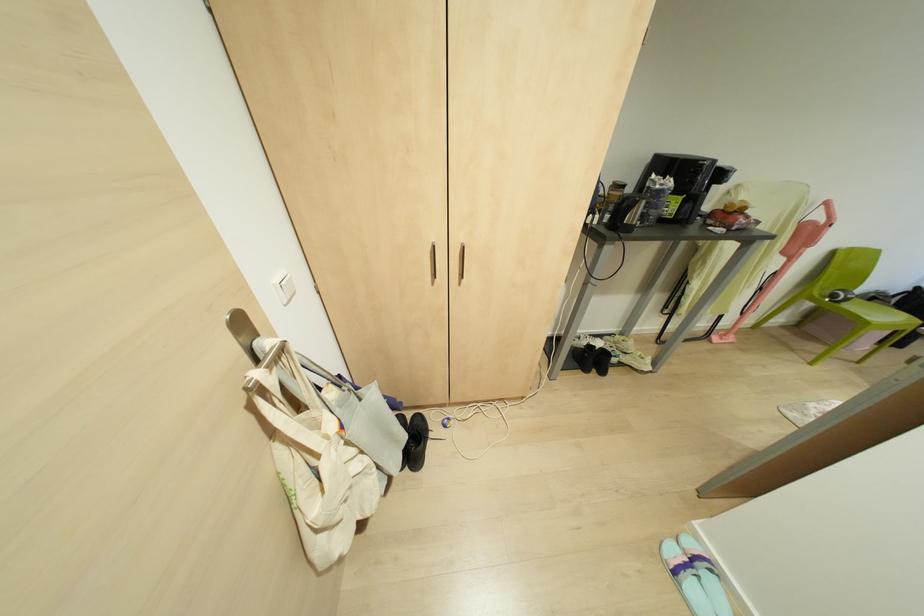
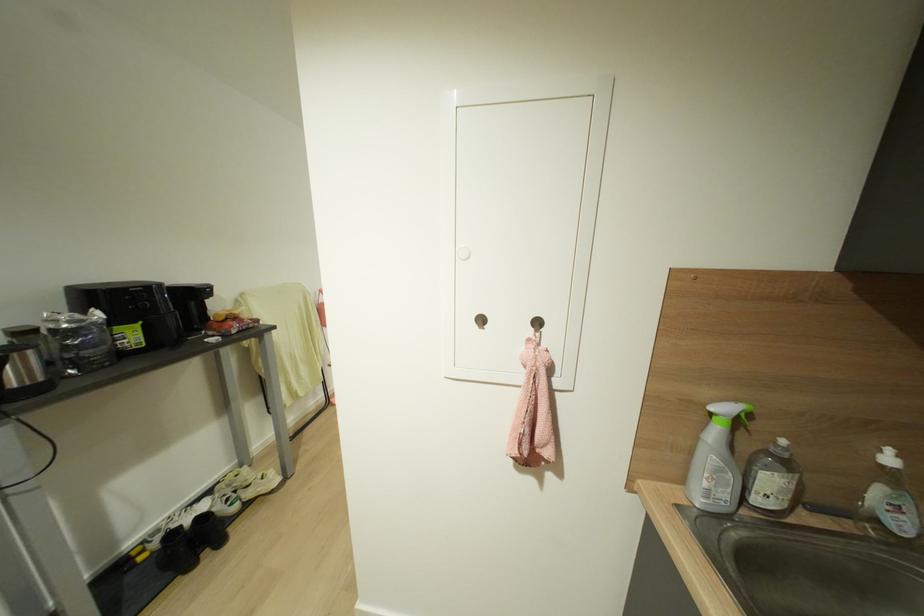
In the second image, find the point that corresponds to point 614,342 in the first image.

(227, 485)